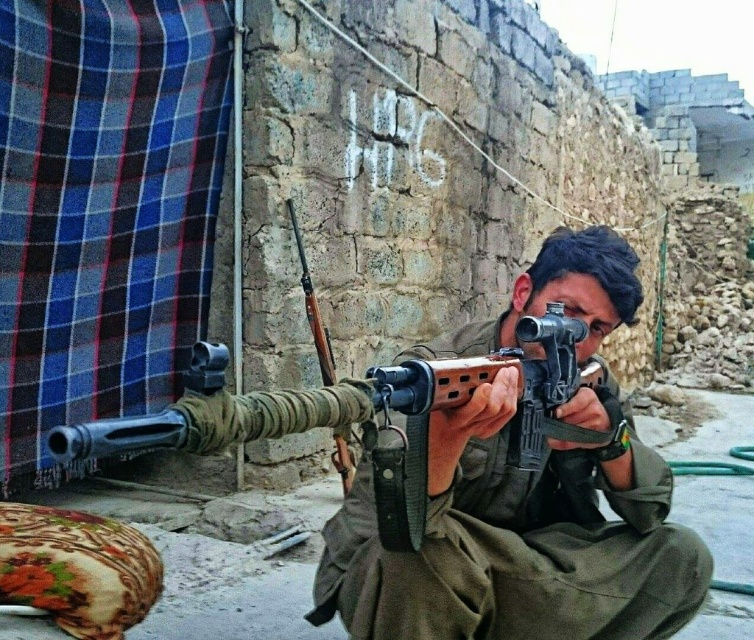
Consider the image. Is matte black rifle at center taller than wooden rifle at center?

Indeed, matte black rifle at center has a greater height compared to wooden rifle at center.

You are a GUI agent. You are given a task and a screenshot of the screen. Output one action in this format:
    pyautogui.click(x=<x>, y=<y>)
    Task: Click on the matte black rifle at center
    The width and height of the screenshot is (754, 640).
    Given the screenshot: What is the action you would take?
    pyautogui.click(x=520, y=538)